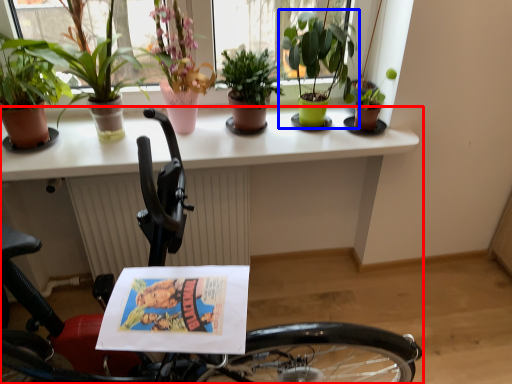
Question: Which object appears farthest to the camera in this image, bicycle (highlighted by a red box) or houseplant (highlighted by a blue box)?

Choices:
 (A) bicycle
 (B) houseplant

Answer: (B)